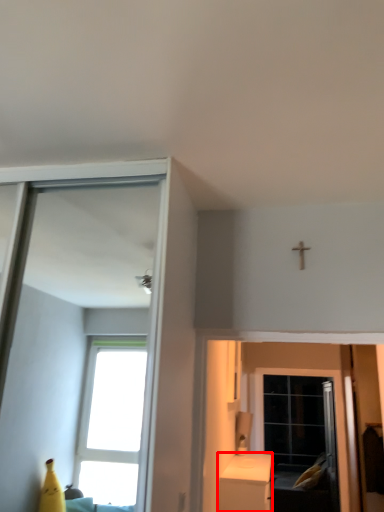
Question: Considering the relative positions of furniture (annotated by the red box) and screen door in the image provided, where is furniture (annotated by the red box) located with respect to the staircase?

Choices:
 (A) right
 (B) left

Answer: (B)